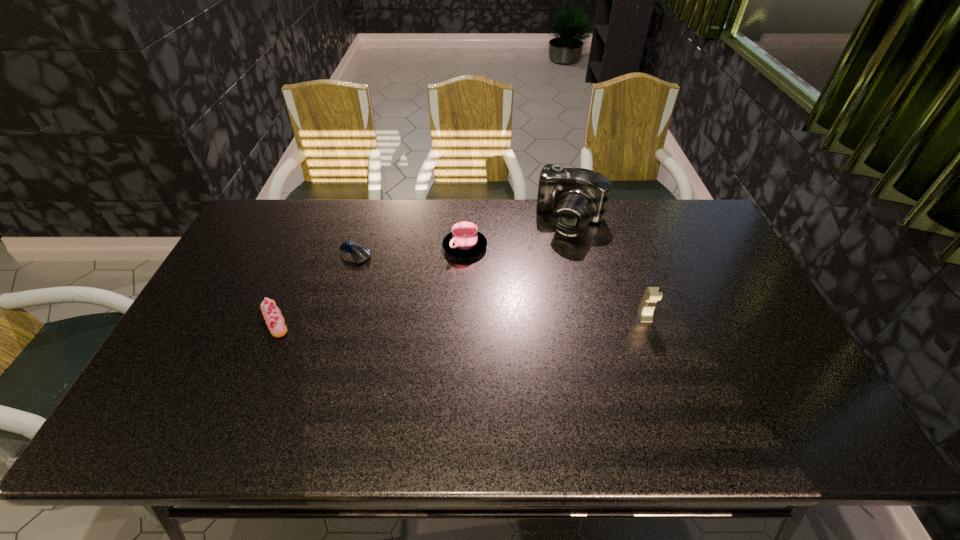
Where is `camera present at the far edge`? The width and height of the screenshot is (960, 540). camera present at the far edge is located at coordinates (577, 196).

Where is `free space at the far edge of the desktop`? This screenshot has height=540, width=960. free space at the far edge of the desktop is located at coordinates (530, 221).

The width and height of the screenshot is (960, 540). In the image, there is a desktop. Identify the location of vacant space at the near edge. (417, 394).

Locate an element on the screen. This screenshot has width=960, height=540. vacant position at the left edge of the desktop is located at coordinates (221, 288).

This screenshot has height=540, width=960. I want to click on blank space at the right edge of the desktop, so click(x=693, y=286).

Where is `free space at the far left corner of the desktop`? free space at the far left corner of the desktop is located at coordinates (266, 201).

In the image, there is a desktop. Identify the location of free space at the near left corner. This screenshot has width=960, height=540. [200, 376].

You are a GUI agent. You are given a task and a screenshot of the screen. Output one action in this format:
    pyautogui.click(x=<x>, y=<y>)
    Task: Click on the vacant area at the far right corner
    
    Given the screenshot: What is the action you would take?
    pyautogui.click(x=674, y=225)

This screenshot has height=540, width=960. I want to click on free location at the near right corner, so click(783, 401).

Identify the location of free space between the cellular telephone and the eclair. The height and width of the screenshot is (540, 960). (460, 319).